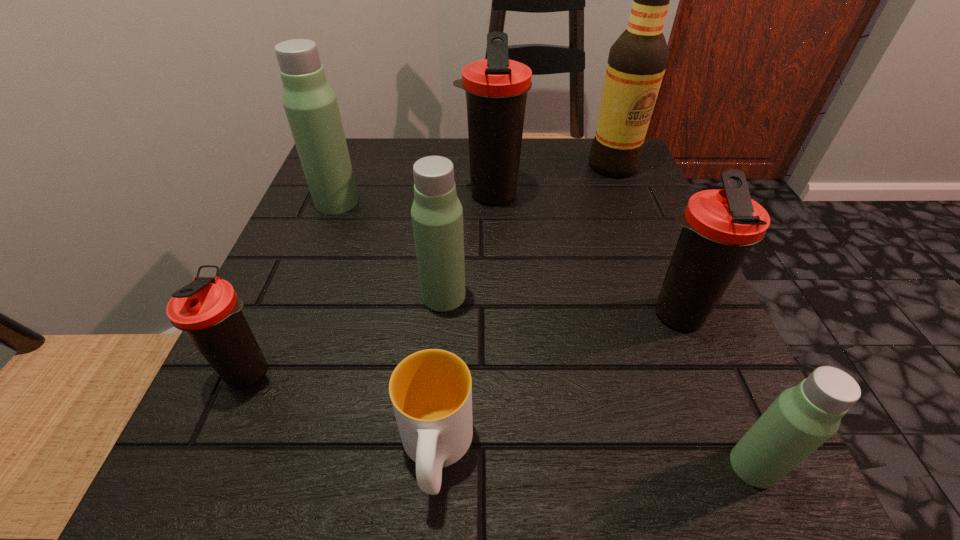
Find the location of a particular element. The image size is (960, 540). the smallest brown thermos bottle is located at coordinates (208, 310).

Identify the location of the fifth farthest thermos bottle. (208, 310).

Where is `the rightmost light thermos bottle`? The width and height of the screenshot is (960, 540). the rightmost light thermos bottle is located at coordinates (802, 418).

Identify the location of the nearest light thermos bottle. point(802,418).

In order to click on cup in this screenshot , I will do `click(431, 390)`.

The width and height of the screenshot is (960, 540). Identify the location of yellow cup. (431, 390).

Where is `vacant region located on the label of the beige alcohol`? This screenshot has height=540, width=960. vacant region located on the label of the beige alcohol is located at coordinates (645, 246).

You are a GUI agent. You are given a task and a screenshot of the screen. Output one action in this format:
    pyautogui.click(x=<x>, y=<y>)
    Task: Click on the vacant region located on the right of the biggest brown thermos bottle
    This screenshot has height=540, width=960.
    Given the screenshot: What is the action you would take?
    pyautogui.click(x=605, y=194)

Locate an element on the screen. free space located on the front of the leftmost light thermos bottle is located at coordinates (306, 280).

The height and width of the screenshot is (540, 960). Find the location of `free space located 0.380m on the back of the second farthest brown thermos bottle`. free space located 0.380m on the back of the second farthest brown thermos bottle is located at coordinates (616, 168).